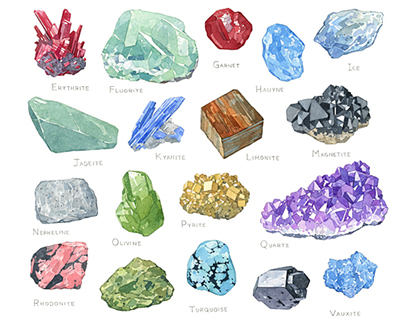
Where is `left column`? This screenshot has height=316, width=404. left column is located at coordinates (61, 268), (49, 184), (45, 135), (45, 25).